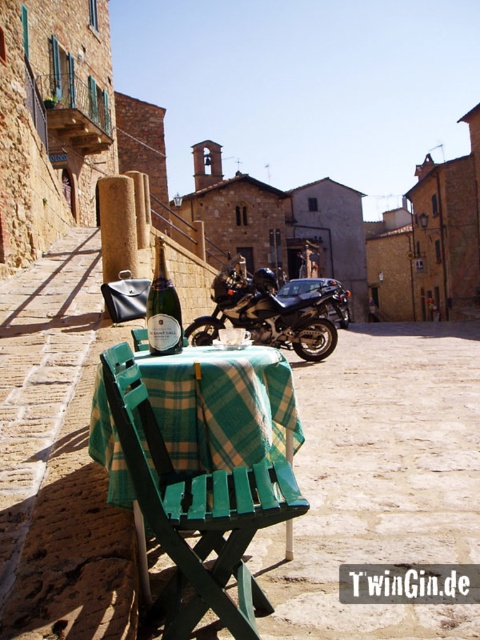
Consider the image. You are a tourist standing in front of the green plaid tablecloth at center and the green plastic chair at center. Which object is closer to you?

The green plaid tablecloth at center is closer to you than the green plastic chair at center.

You are a tourist standing on the cobblestone street looking at the green plaid tablecloth at center and the green plastic chair at center. Which object is closer to the ground?

The green plastic chair at center is closer to the ground because the green plaid tablecloth at center is located above it.

You are standing at the entrance of the stone building and want to park your shiny black motorcycle at center in a spot that is closest to the cobblestone street. Based on its current position, is the motorcycle already positioned closer to the cobblestone street or further away from it?

The motorcycle is positioned at point [268,314]. Since the cobblestone street is in the background of the image, the motorcycle is closer to the cobblestone street.